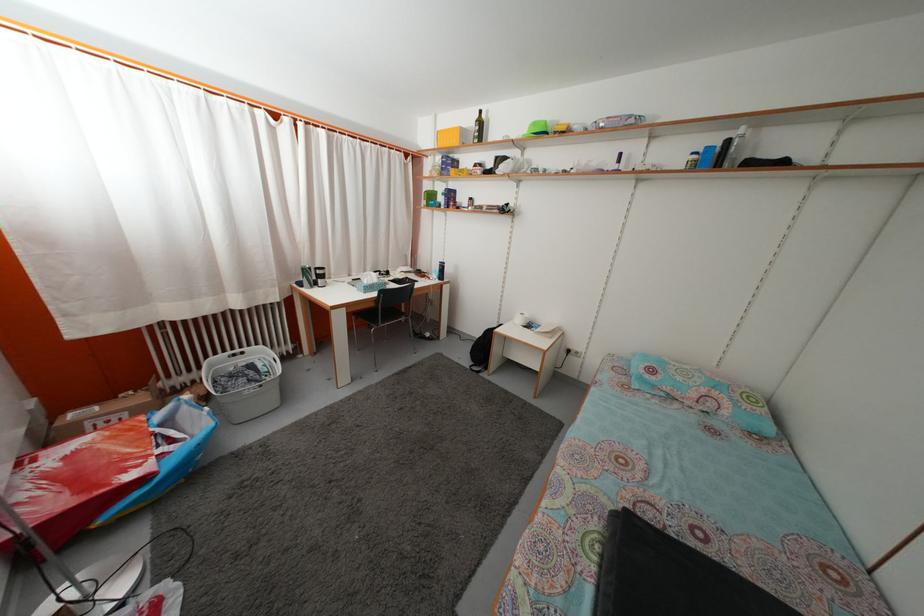
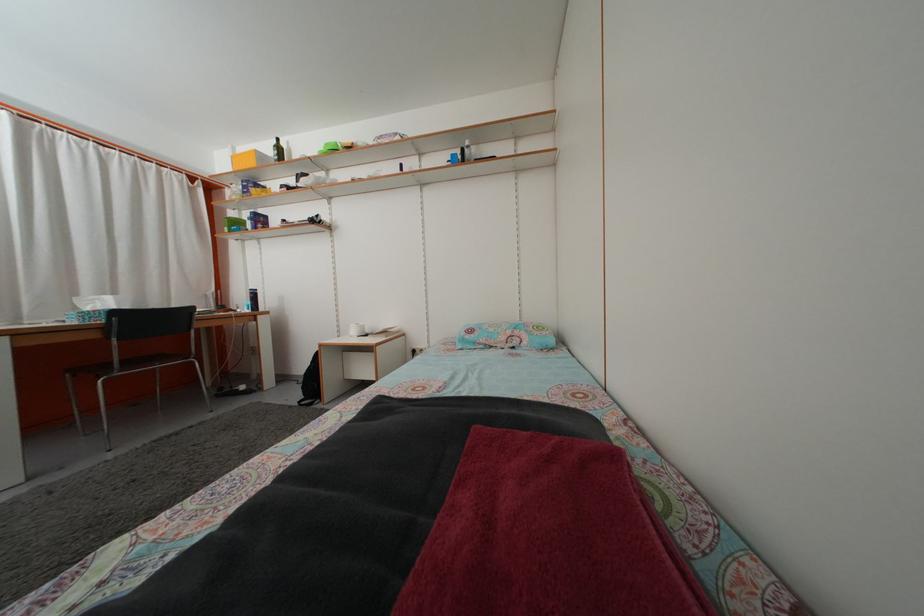
Find the pixel in the second image that matches pixel 441 124 in the first image.

(239, 156)